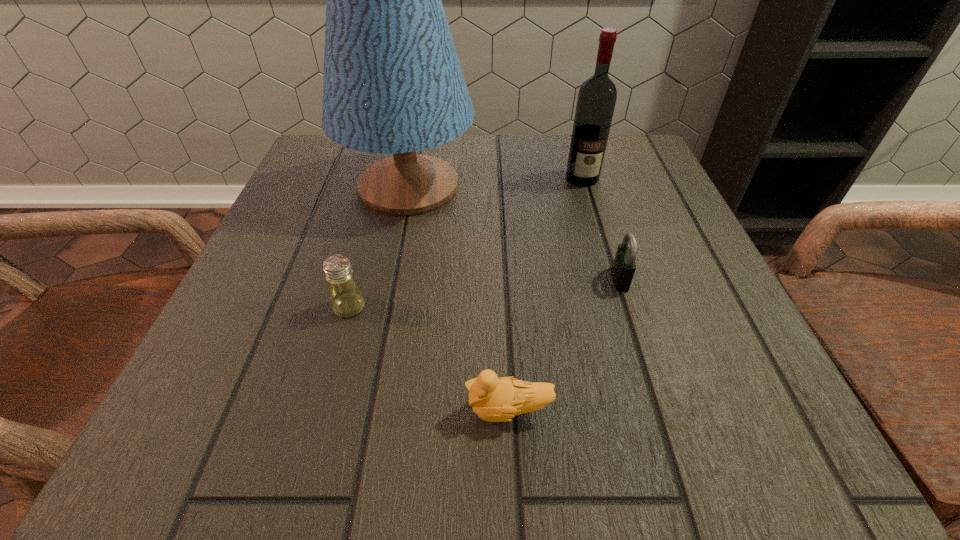
The image size is (960, 540). Identify the location of object that stands as the fourth closest to the saltshaker. (597, 96).

The height and width of the screenshot is (540, 960). I want to click on vacant point that satisfies the following two spatial constraints: 1. on the front and back of the alcohol; 2. on the face of the nearest object, so click(x=651, y=410).

Where is `free space that satisfies the following two spatial constraints: 1. on the back side of the saltshaker; 2. on the left side of the tallest object`? Image resolution: width=960 pixels, height=540 pixels. free space that satisfies the following two spatial constraints: 1. on the back side of the saltshaker; 2. on the left side of the tallest object is located at coordinates (383, 186).

Locate an element on the screen. This screenshot has height=540, width=960. free space that satisfies the following two spatial constraints: 1. on the front and back of the second tallest object; 2. on the face of the nearest object is located at coordinates (651, 410).

Image resolution: width=960 pixels, height=540 pixels. Find the location of `free spot that satisfies the following two spatial constraints: 1. on the front and back of the alcohol; 2. on the face of the duckling`. free spot that satisfies the following two spatial constraints: 1. on the front and back of the alcohol; 2. on the face of the duckling is located at coordinates (651, 410).

Where is `free location that satisfies the following two spatial constraints: 1. on the front side of the third nearest object; 2. on the right side of the lampshade`? free location that satisfies the following two spatial constraints: 1. on the front side of the third nearest object; 2. on the right side of the lampshade is located at coordinates (390, 279).

The image size is (960, 540). Find the location of `blank space that satisfies the following two spatial constraints: 1. on the front and back of the third nearest object; 2. on the left side of the second tallest object`. blank space that satisfies the following two spatial constraints: 1. on the front and back of the third nearest object; 2. on the left side of the second tallest object is located at coordinates (612, 279).